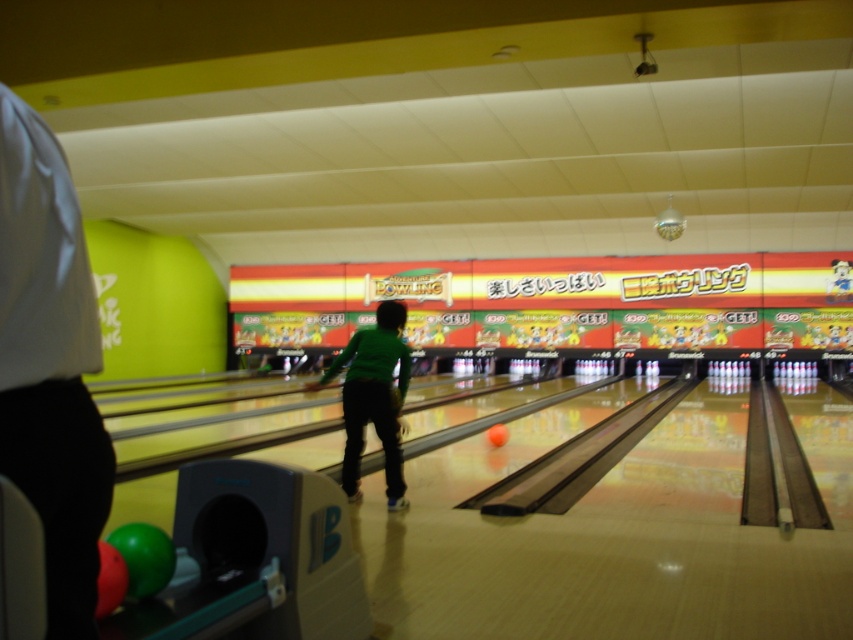
You are standing at the entrance of the indoor bowling alley and see the white fabric shirt at left and the green matte shirt at center. Which person is closer to you?

The white fabric shirt at left is closer to you because it is in front of the green matte shirt at center.

You are standing at the point marked by the coordinates (x=50, y=364) in the image. What is the nearest object to you?

The nearest object to you at point (x=50, y=364) is the white fabric shirt at left.

You are observing an indoor bowling alley scene. You see a white fabric shirt at left and a green matte shirt at center. Which person is shorter?

The white fabric shirt at left has a lesser height compared to the green matte shirt at center, so the person wearing the white fabric shirt at left is shorter.